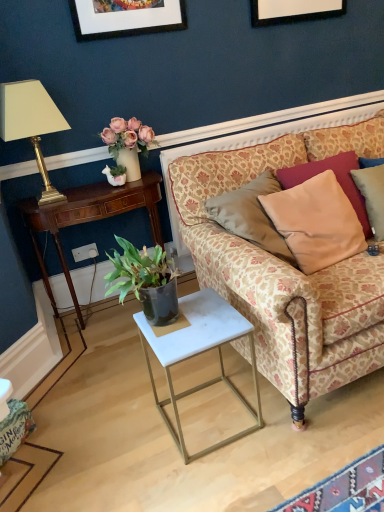
You are a GUI agent. You are given a task and a screenshot of the screen. Output one action in this format:
    pyautogui.click(x=<x>, y=<y>)
    Task: Click on the vacant area on the back side of white marble table at lower center
    
    Given the screenshot: What is the action you would take?
    pyautogui.click(x=201, y=370)